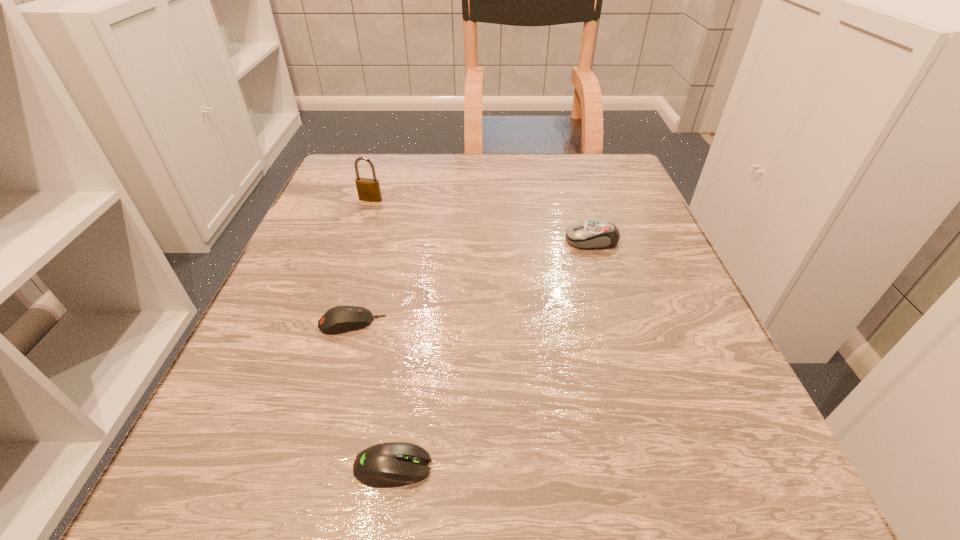
Locate an element on the screen. empty space between the rightmost computer mouse and the second computer mouse from right to left is located at coordinates click(x=492, y=354).

This screenshot has height=540, width=960. In order to click on empty space that is in between the second farthest computer mouse and the second object from right to left in this screenshot , I will do `click(372, 395)`.

Locate an element on the screen. The height and width of the screenshot is (540, 960). free space between the third shortest object and the leftmost computer mouse is located at coordinates (472, 282).

Find the location of a particular element. This screenshot has height=540, width=960. free point between the padlock and the leftmost computer mouse is located at coordinates click(x=361, y=261).

At what (x,y) coordinates should I click in order to perform the action: click on free spot between the leftmost computer mouse and the third object from left to right. Please return your answer as a coordinate pair (x, y). This screenshot has width=960, height=540. Looking at the image, I should click on (372, 395).

The image size is (960, 540). I want to click on free spot between the nearest object and the third farthest object, so point(372,395).

The image size is (960, 540). I want to click on unoccupied area between the leftmost computer mouse and the nearest object, so click(372, 395).

In order to click on vacant area that lies between the third object from left to right and the third nearest object in this screenshot , I will do `click(492, 354)`.

Identify which object is the second closest to the third farthest object. Please provide its 2D coordinates. Your answer should be formatted as a tuple, i.e. [(x, y)], where the tuple contains the x and y coordinates of a point satisfying the conditions above.

[(368, 189)]

Image resolution: width=960 pixels, height=540 pixels. In order to click on object that stands as the second closest to the second farthest object in this screenshot , I will do `click(368, 189)`.